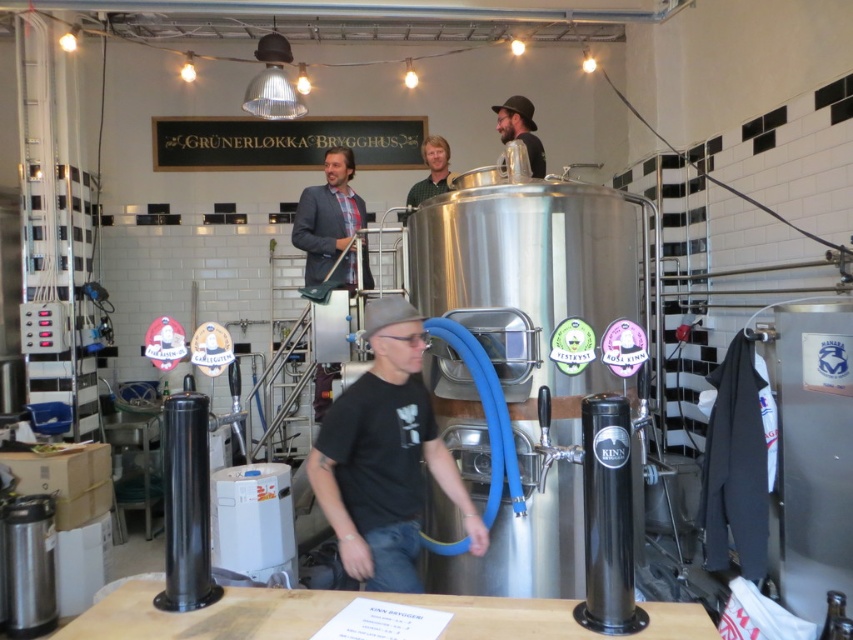
Who is lower down, matte black hat at upper center or matte green shirt at center?

matte green shirt at center

Does matte black hat at upper center have a greater width compared to matte green shirt at center?

Yes, matte black hat at upper center is wider than matte green shirt at center.

Is point (531, 122) positioned after point (427, 188)?

No, it is in front of (427, 188).

This screenshot has height=640, width=853. Identify the location of matte black hat at upper center. (520, 131).

Between black matte t-shirt at center and matte green shirt at center, which one appears on the left side from the viewer's perspective?

From the viewer's perspective, black matte t-shirt at center appears more on the left side.

Can you confirm if black matte t-shirt at center is shorter than matte green shirt at center?

No, black matte t-shirt at center is not shorter than matte green shirt at center.

Is point (404, 538) more distant than point (410, 202)?

No, it is not.

The image size is (853, 640). I want to click on black matte t-shirt at center, so click(x=386, y=456).

Does black matte t-shirt at center have a lesser width compared to matte black hat at upper center?

No, black matte t-shirt at center is not thinner than matte black hat at upper center.

Between point (346, 442) and point (502, 104), which one is positioned behind?

Positioned behind is point (502, 104).

Identify the location of black matte t-shirt at center. This screenshot has width=853, height=640. (386, 456).